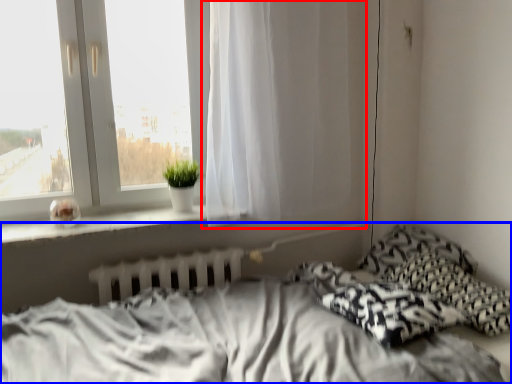
Question: Which object appears farthest to the camera in this image, curtain (highlighted by a red box) or bed (highlighted by a blue box)?

Choices:
 (A) curtain
 (B) bed

Answer: (A)